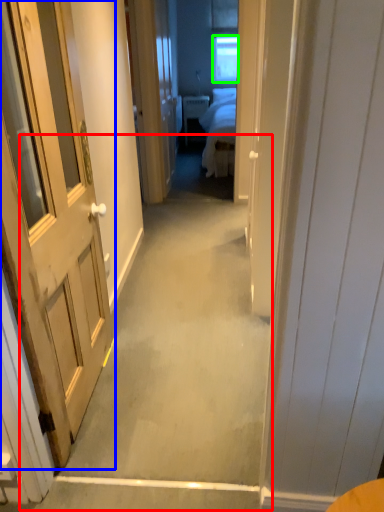
Question: Which is nearer to the path (highlighted by a red box)? door (highlighted by a blue box) or window (highlighted by a green box).

Choices:
 (A) door
 (B) window

Answer: (A)